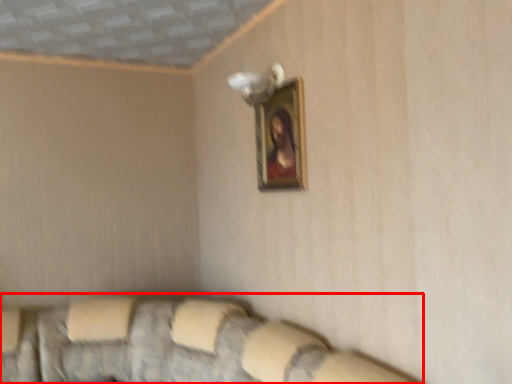
Question: From the image's perspective, considering the relative positions of couch (annotated by the red box) and picture frame in the image provided, where is couch (annotated by the red box) located with respect to the staircase?

Choices:
 (A) above
 (B) below

Answer: (B)